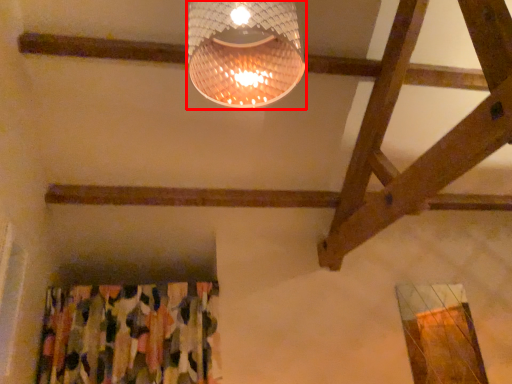
Question: From the image's perspective, where is lamp (annotated by the red box) located relative to curtain?

Choices:
 (A) below
 (B) above

Answer: (B)